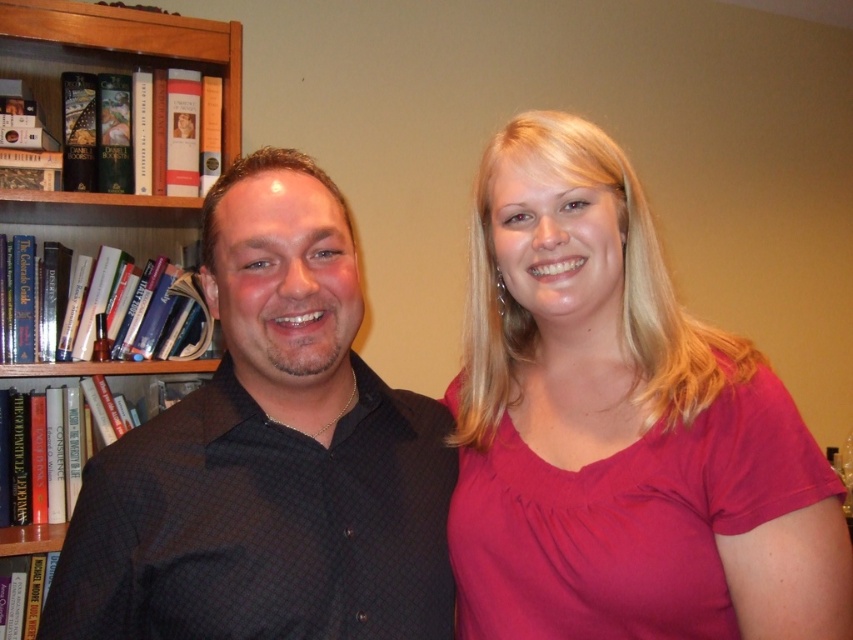
How far apart are pink fabric shirt at right and black dotted shirt at left?

The distance of pink fabric shirt at right from black dotted shirt at left is 7.99 inches.

Is point (643, 371) farther from viewer compared to point (216, 212)?

Yes, it is behind point (216, 212).

Identify the location of pink fabric shirt at right. (619, 428).

Does black dotted shirt at left appear under wooden bookcase at left?

Yes.

Can you confirm if black dotted shirt at left is shorter than wooden bookcase at left?

No.

What do you see at coordinates (270, 456) in the screenshot? The height and width of the screenshot is (640, 853). I see `black dotted shirt at left` at bounding box center [270, 456].

The image size is (853, 640). I want to click on black dotted shirt at left, so click(x=270, y=456).

Does pink fabric shirt at right appear on the right side of wooden bookcase at left?

Correct, you'll find pink fabric shirt at right to the right of wooden bookcase at left.

The height and width of the screenshot is (640, 853). I want to click on pink fabric shirt at right, so click(619, 428).